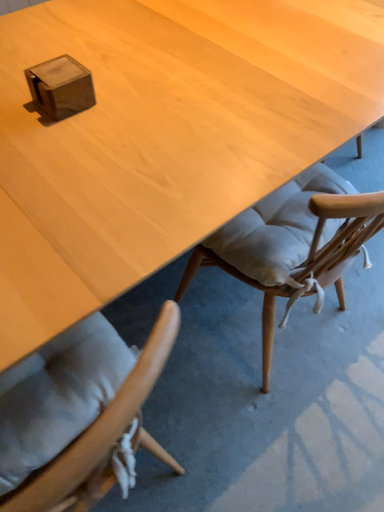
Question: Is light wood desk at center inside or outside of wooden cube at upper left?

Choices:
 (A) inside
 (B) outside

Answer: (B)

Question: Is light wood desk at center wider or thinner than wooden cube at upper left?

Choices:
 (A) thin
 (B) wide

Answer: (B)

Question: Is light wood desk at center taller or shorter than wooden cube at upper left?

Choices:
 (A) tall
 (B) short

Answer: (A)

Question: From a real-world perspective, is wooden cube at upper left above or below light wood desk at center?

Choices:
 (A) below
 (B) above

Answer: (B)

Question: Relative to light wood desk at center, is wooden cube at upper left in front or behind?

Choices:
 (A) behind
 (B) front

Answer: (A)

Question: Considering the positions of point (84, 101) and point (256, 42), is point (84, 101) closer or farther from the camera than point (256, 42)?

Choices:
 (A) farther
 (B) closer

Answer: (B)

Question: Would you say wooden cube at upper left is to the left or to the right of light wood desk at center in the picture?

Choices:
 (A) right
 (B) left

Answer: (B)